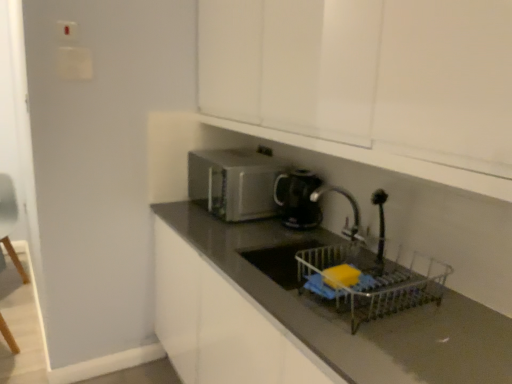
Question: Should I look upward or downward to see satin silver microwave at center?

Choices:
 (A) down
 (B) up

Answer: (B)

Question: Is metallic silver dish rack at lower center positioned behind satin silver microwave at center?

Choices:
 (A) yes
 (B) no

Answer: (B)

Question: From a real-world perspective, is metallic silver dish rack at lower center physically above satin silver microwave at center?

Choices:
 (A) yes
 (B) no

Answer: (B)

Question: Does metallic silver dish rack at lower center have a greater width compared to satin silver microwave at center?

Choices:
 (A) no
 (B) yes

Answer: (A)

Question: Does metallic silver dish rack at lower center have a lesser height compared to satin silver microwave at center?

Choices:
 (A) no
 (B) yes

Answer: (B)

Question: From a real-world perspective, is metallic silver dish rack at lower center beneath satin silver microwave at center?

Choices:
 (A) yes
 (B) no

Answer: (A)

Question: Is metallic silver dish rack at lower center with satin silver microwave at center?

Choices:
 (A) no
 (B) yes

Answer: (A)

Question: From the image's perspective, is black glossy countertop at center on metallic silver dish rack at lower center?

Choices:
 (A) yes
 (B) no

Answer: (B)

Question: Does black glossy countertop at center have a greater width compared to metallic silver dish rack at lower center?

Choices:
 (A) no
 (B) yes

Answer: (B)

Question: From the image's perspective, is black glossy countertop at center beneath metallic silver dish rack at lower center?

Choices:
 (A) yes
 (B) no

Answer: (A)

Question: Is black glossy countertop at center positioned before metallic silver dish rack at lower center?

Choices:
 (A) no
 (B) yes

Answer: (B)

Question: Considering the relative positions of black glossy countertop at center and metallic silver dish rack at lower center in the image provided, is black glossy countertop at center behind metallic silver dish rack at lower center?

Choices:
 (A) yes
 (B) no

Answer: (B)

Question: Is black glossy countertop at center at the right side of metallic silver dish rack at lower center?

Choices:
 (A) yes
 (B) no

Answer: (B)

Question: Can you confirm if white glossy cabinet at upper center is positioned to the left of metallic silver dish rack at lower center?

Choices:
 (A) yes
 (B) no

Answer: (A)